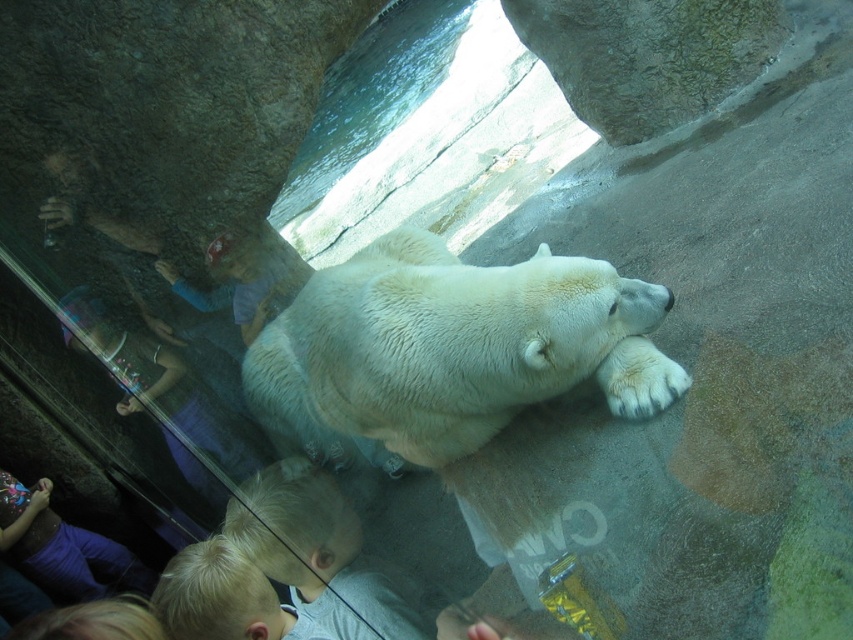
Which of these two, white fluffy polar bear at center or white fur paw at lower center, stands taller?

With more height is white fluffy polar bear at center.

Is the position of white fluffy polar bear at center less distant than that of white fur paw at lower center?

That is True.

Locate an element on the screen. The height and width of the screenshot is (640, 853). white fluffy polar bear at center is located at coordinates (450, 349).